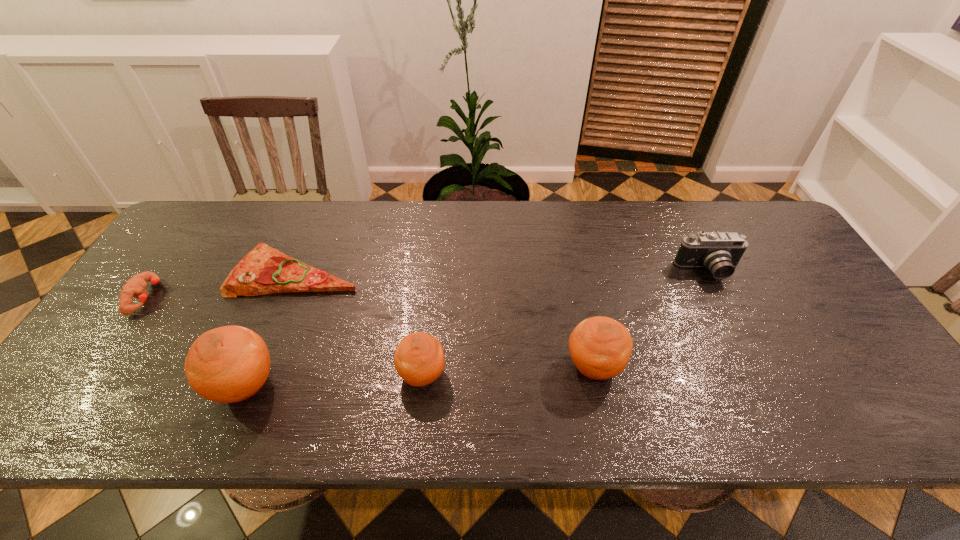
Locate an element on the screen. This screenshot has height=540, width=960. vacant space that's between the fifth shortest object and the pizza is located at coordinates pyautogui.click(x=445, y=319).

Locate an element on the screen. Image resolution: width=960 pixels, height=540 pixels. free space between the puncher and the shortest object is located at coordinates (222, 285).

I want to click on free space between the shortest object and the rightmost orange, so click(445, 319).

This screenshot has height=540, width=960. In order to click on free space that is in between the shortest object and the camera in this screenshot , I will do `click(503, 272)`.

This screenshot has height=540, width=960. I want to click on empty space that is in between the shortest object and the puncher, so click(x=222, y=285).

The width and height of the screenshot is (960, 540). Find the location of `unoccupied area between the second tallest orange and the camera`. unoccupied area between the second tallest orange and the camera is located at coordinates (651, 319).

The width and height of the screenshot is (960, 540). I want to click on free spot between the rightmost object and the second orange from right to left, so click(x=565, y=323).

Identify which object is located as the nearest to the rightmost object. Please provide its 2D coordinates. Your answer should be formatted as a tuple, i.e. [(x, y)], where the tuple contains the x and y coordinates of a point satisfying the conditions above.

[(600, 347)]

Locate which object ranks fourth in proximity to the leftmost orange. Please provide its 2D coordinates. Your answer should be formatted as a tuple, i.e. [(x, y)], where the tuple contains the x and y coordinates of a point satisfying the conditions above.

[(600, 347)]

Choose which orange is the third nearest neighbor to the rightmost object. Please provide its 2D coordinates. Your answer should be formatted as a tuple, i.e. [(x, y)], where the tuple contains the x and y coordinates of a point satisfying the conditions above.

[(229, 364)]